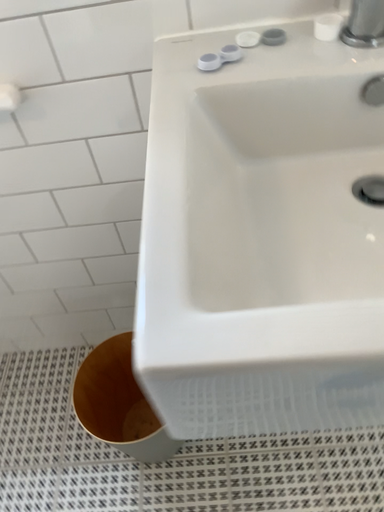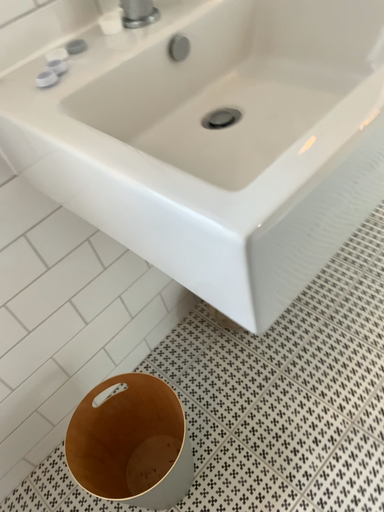
Question: How did the camera likely rotate when shooting the video?

Choices:
 (A) rotated upward
 (B) rotated downward

Answer: (A)